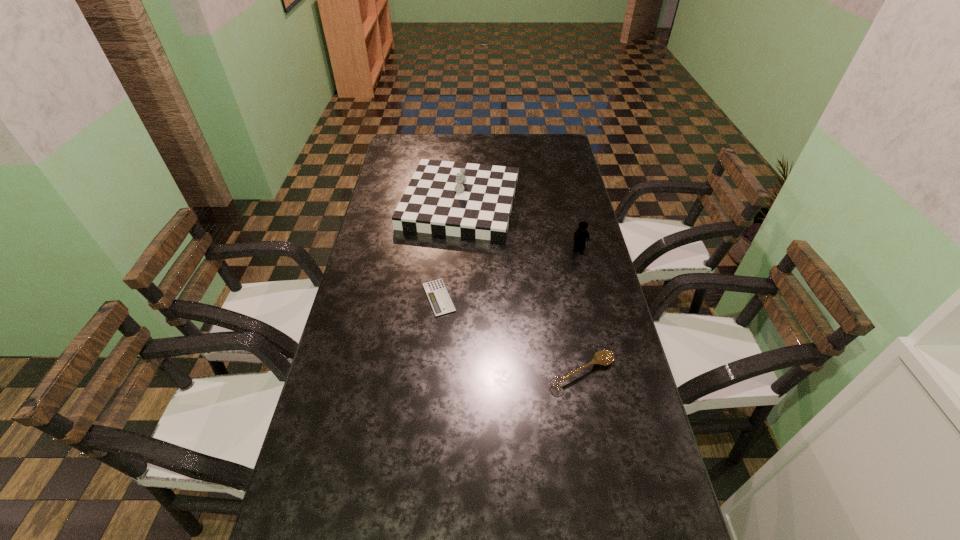
I want to click on object that is the second closest to the nearest object, so click(580, 236).

At what (x,y) coordinates should I click in order to perform the action: click on object that is the third closest one to the checkerboard. Please return your answer as a coordinate pair (x, y). This screenshot has width=960, height=540. Looking at the image, I should click on (603, 357).

The width and height of the screenshot is (960, 540). Identify the location of vacant space that satisfies the following two spatial constraints: 1. on the back side of the tallest object; 2. on the left side of the second nearest object. (447, 202).